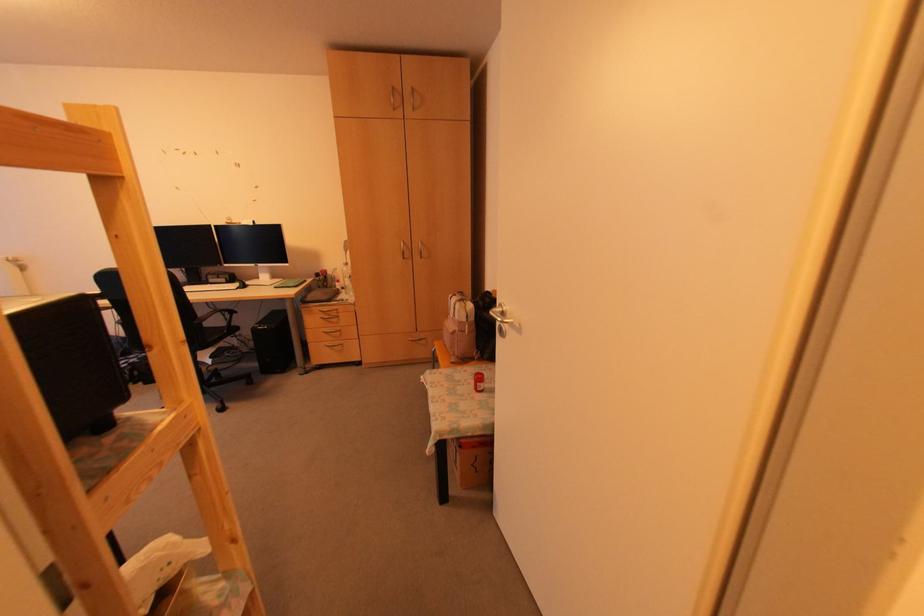
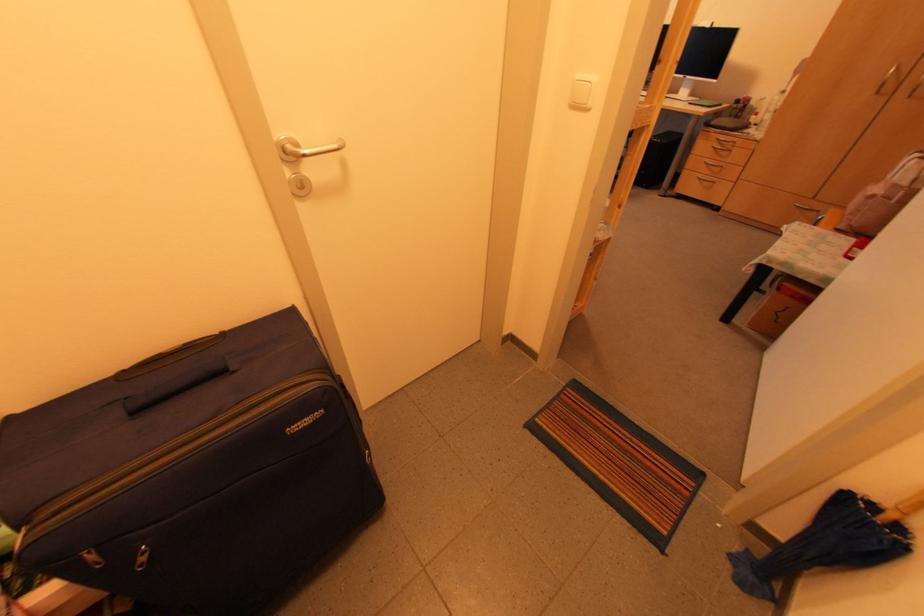
Locate, in the second image, the point that corresponds to (x=406, y=254) in the first image.

(886, 87)